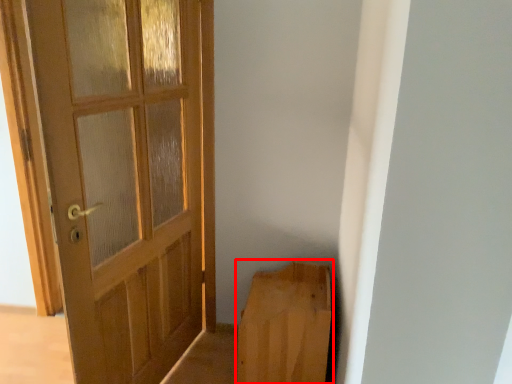
Question: From the image's perspective, where is furniture (annotated by the red box) located in relation to door in the image?

Choices:
 (A) below
 (B) above

Answer: (A)